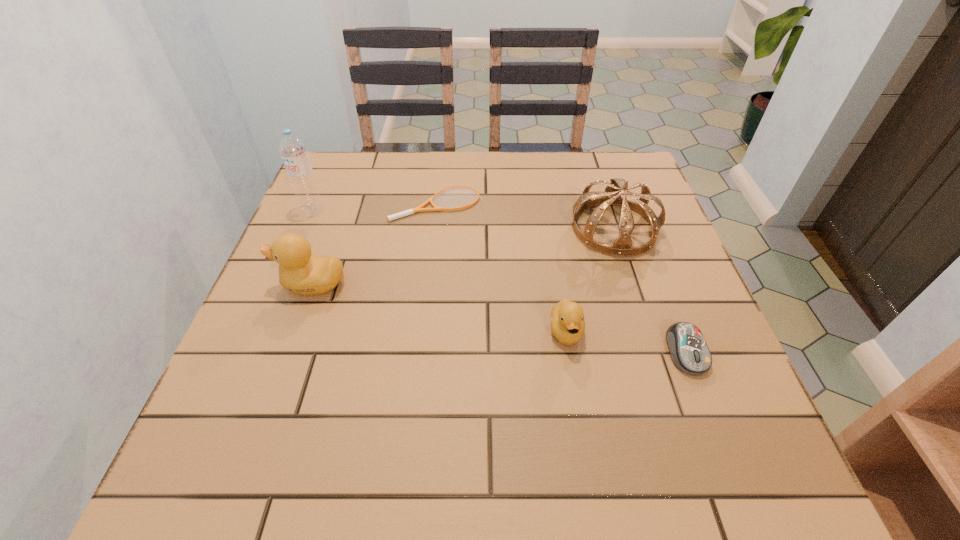
Please point a location where one more duckling can be added evenly. Please provide its 2D coordinates. Your answer should be formatted as a tuple, i.e. [(x, y)], where the tuple contains the x and y coordinates of a point satisfying the conditions above.

[(433, 307)]